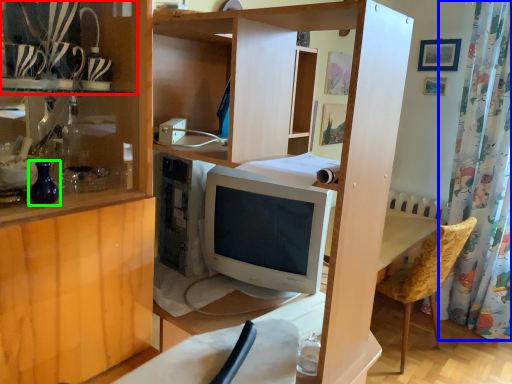
Question: Which object is positioned farthest from shelf (highlighted by a red box)? Select from shower curtain (highlighted by a blue box) and glass vase (highlighted by a green box).

Choices:
 (A) shower curtain
 (B) glass vase

Answer: (A)